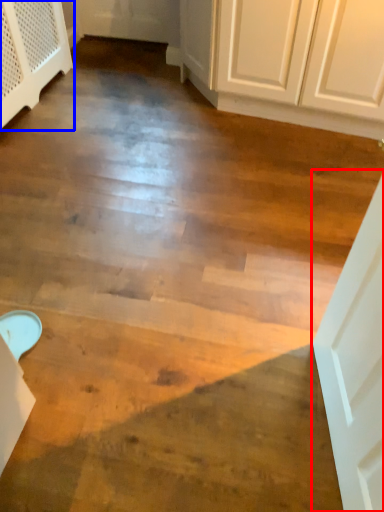
Question: Which object is closer to the camera taking this photo, door (highlighted by a red box) or dresser (highlighted by a blue box)?

Choices:
 (A) door
 (B) dresser

Answer: (A)